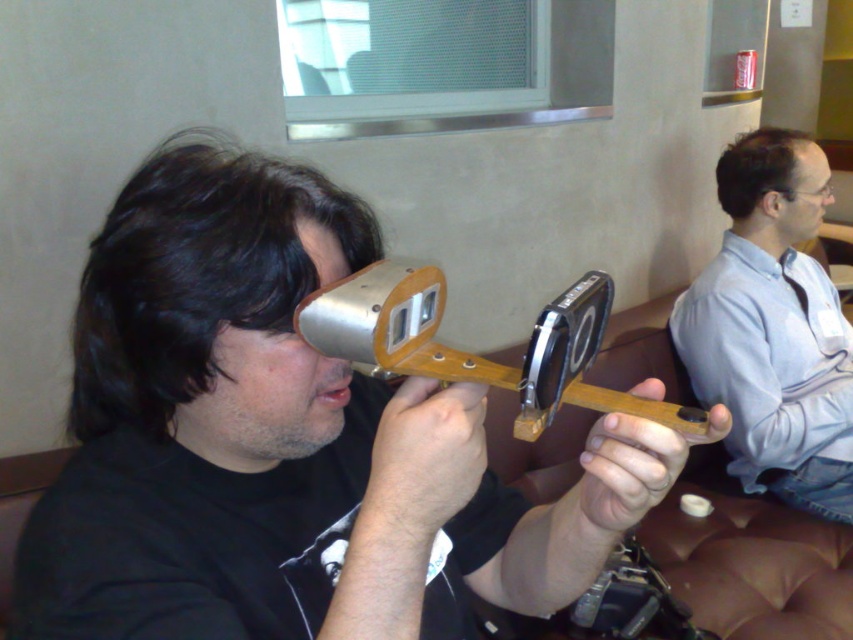
Question: Is light blue shirt at right above metal/wooden tool at center?

Choices:
 (A) no
 (B) yes

Answer: (B)

Question: Among these objects, which one is nearest to the camera?

Choices:
 (A) metal/wooden tool at center
 (B) matte black device at center
 (C) light blue shirt at right

Answer: (A)

Question: Which point is closer to the camera?

Choices:
 (A) (352, 468)
 (B) (724, 340)

Answer: (A)

Question: Observing the image, what is the correct spatial positioning of matte black device at center in reference to metal/wooden tool at center?

Choices:
 (A) left
 (B) right

Answer: (A)

Question: Can you confirm if light blue shirt at right is positioned to the right of metal/wooden tool at center?

Choices:
 (A) yes
 (B) no

Answer: (A)

Question: Among these objects, which one is farthest from the camera?

Choices:
 (A) light blue shirt at right
 (B) matte black device at center

Answer: (A)